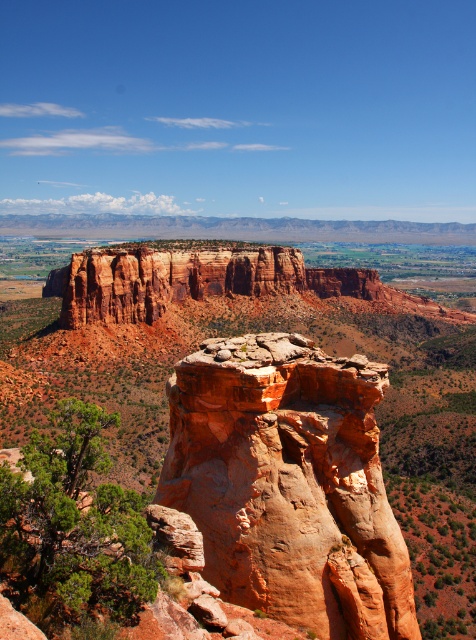
You are a hiker planning to traverse the valley. You see the rustic sandstone canyon at center and the rustic sandstone rock formation at center. Which one is higher up in the landscape?

The rustic sandstone canyon at center is above the rustic sandstone rock formation at center, so the rustic sandstone canyon at center is higher up in the landscape.

You are standing at the origin point of the coordinate system. You want to reach the rustic sandstone canyon at center. In which direction should you move?

You should move towards the coordinates point (257, 332) to reach the rustic sandstone canyon at center.